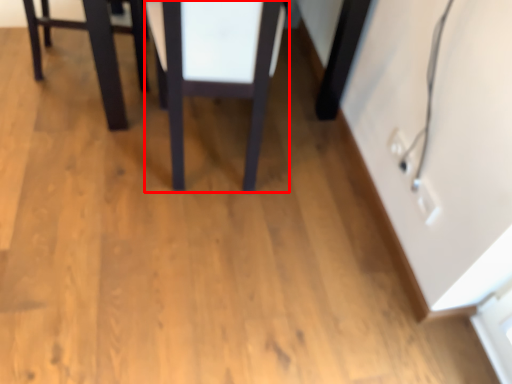
Question: From the image's perspective, where is table (annotated by the red box) located in relation to furniture in the image?

Choices:
 (A) below
 (B) above

Answer: (A)